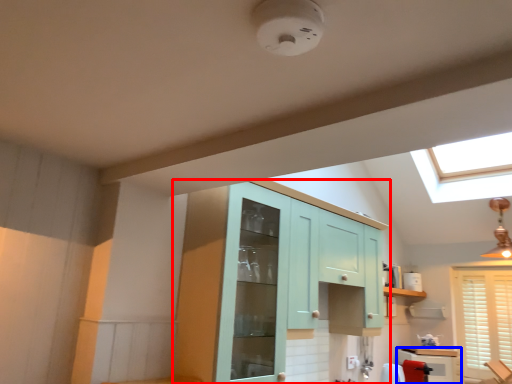
Question: Which point is closer to the camera, cabinetry (highlighted by a red box) or cabinetry (highlighted by a blue box)?

Choices:
 (A) cabinetry
 (B) cabinetry

Answer: (A)